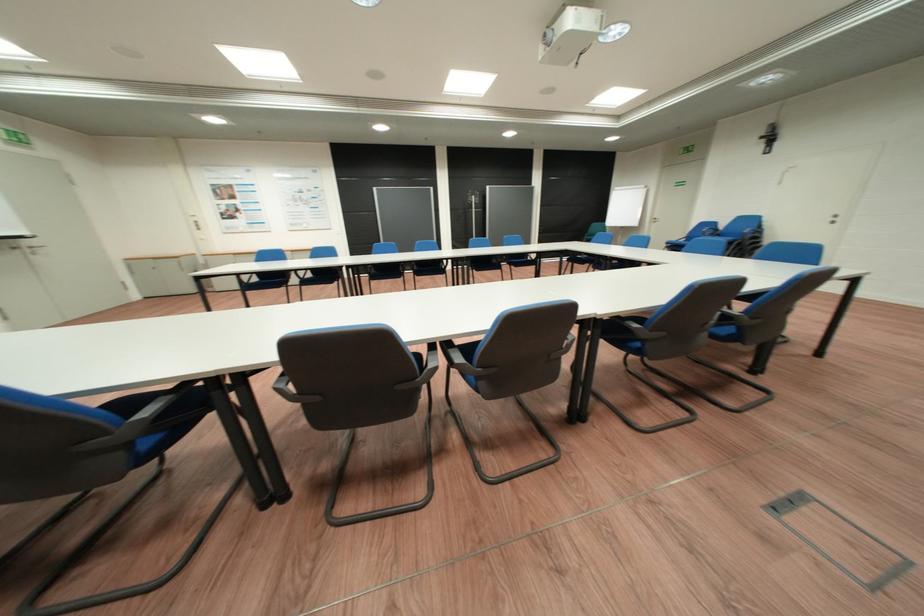
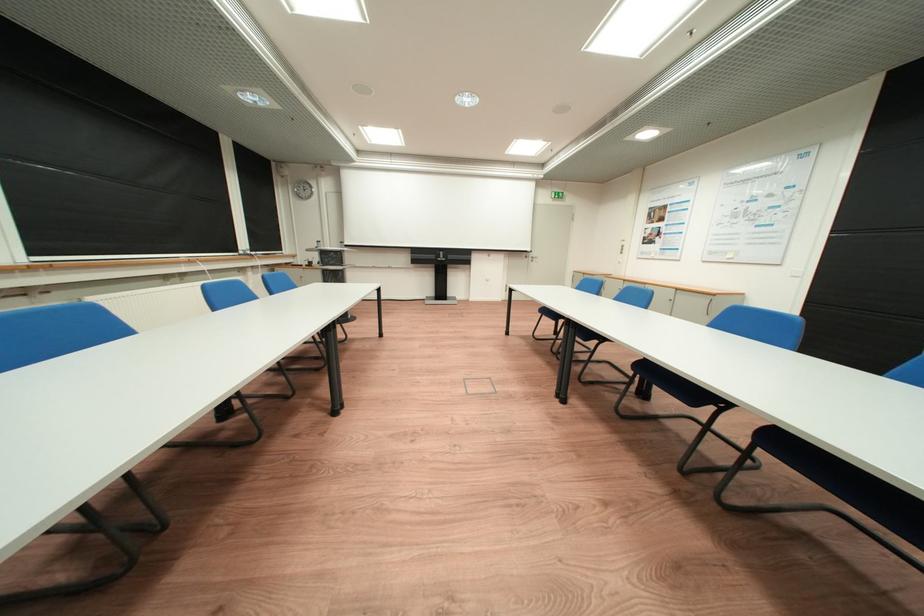
Question: I am providing you with two images of the same scene from different viewpoints. Which of the following objects are not visible in image2?

Choices:
 (A) white cosmetic bottle
 (B) blue chair sitting surface
 (C) door handle
 (D) projector screen handle

Answer: (B)